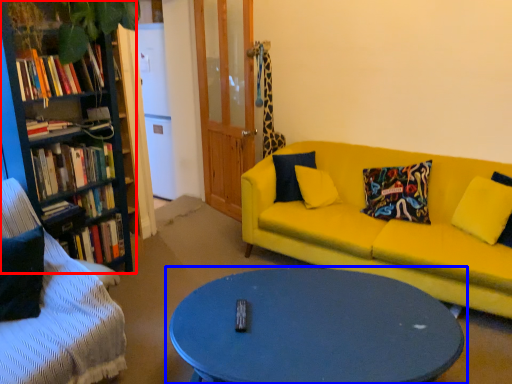
Question: Which point is closer to the camera, bookcase (highlighted by a red box) or coffee table (highlighted by a blue box)?

Choices:
 (A) bookcase
 (B) coffee table

Answer: (B)